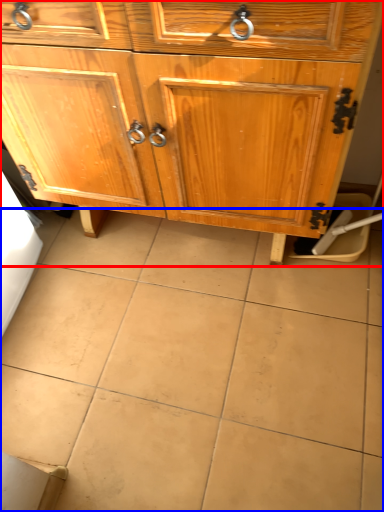
Question: Among these objects, which one is farthest to the camera, chest of drawers (highlighted by a red box) or ceramic tile (highlighted by a blue box)?

Choices:
 (A) chest of drawers
 (B) ceramic tile

Answer: (B)